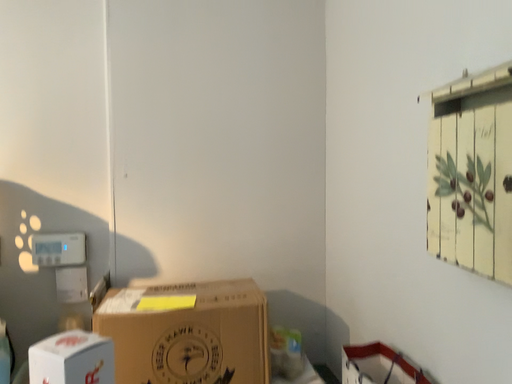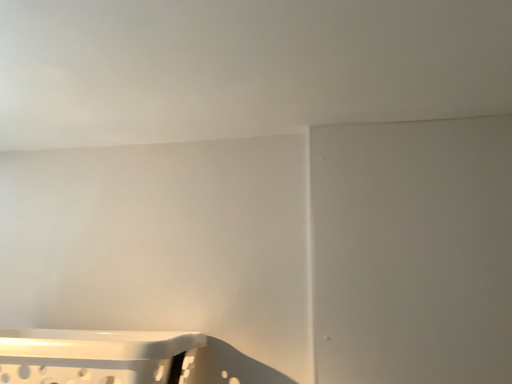
Question: Which way did the camera rotate in the video?

Choices:
 (A) rotated upward
 (B) rotated downward

Answer: (A)